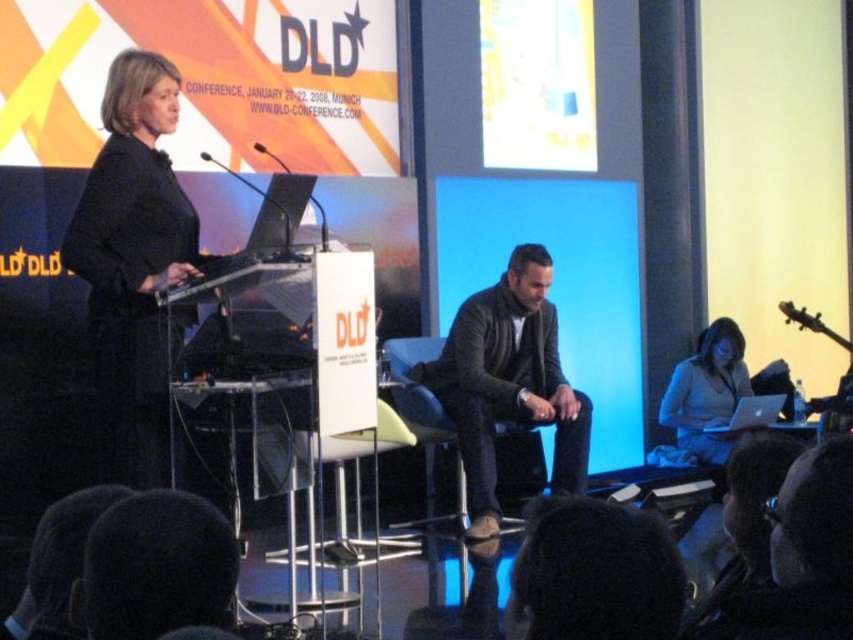
Is point (68, 634) more distant than point (711, 452)?

No, it is in front of (711, 452).

What do you see at coordinates (57, 564) in the screenshot? This screenshot has width=853, height=640. I see `dark brown leather jacket at lower center` at bounding box center [57, 564].

This screenshot has height=640, width=853. I want to click on dark brown leather jacket at lower center, so click(57, 564).

Is black matte blazer at left bigger than leather jacket at center?

Incorrect, black matte blazer at left is not larger than leather jacket at center.

How far apart are black matte blazer at left and leather jacket at center?

black matte blazer at left is 2.17 meters away from leather jacket at center.

The height and width of the screenshot is (640, 853). What do you see at coordinates (134, 264) in the screenshot?
I see `black matte blazer at left` at bounding box center [134, 264].

The height and width of the screenshot is (640, 853). I want to click on black matte blazer at left, so click(134, 264).

Is point (163, 280) positioned after point (677, 408)?

No.

Does black matte blazer at left appear on the left side of matte white laptop at lower right?

Yes, black matte blazer at left is to the left of matte white laptop at lower right.

Image resolution: width=853 pixels, height=640 pixels. What are the coordinates of `black matte blazer at left` in the screenshot? It's located at (134, 264).